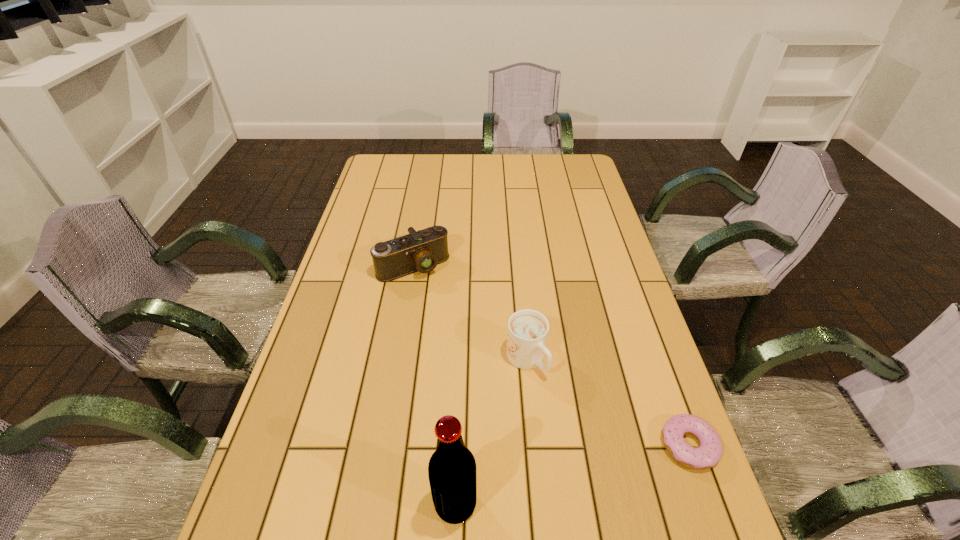
Identify the location of free space on the desktop that is between the nearest object and the doughnut and is positioned on the side with the handle of the third nearest object. The width and height of the screenshot is (960, 540). (611, 465).

I want to click on vacant space on the desktop that is between the beer bottle and the rightmost object and is positioned on the lens of the farthest object, so click(558, 478).